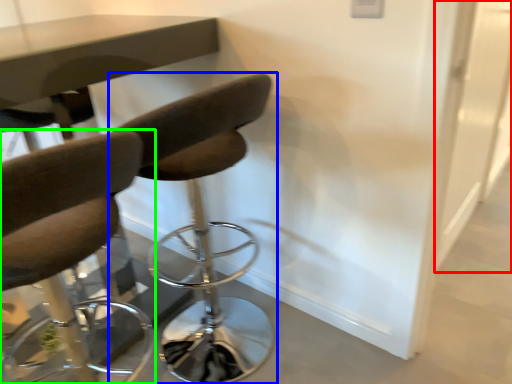
Question: Estimate the real-world distances between objects in this image. Which object is farther from glass door (highlighted by a red box), chair (highlighted by a blue box) or chair (highlighted by a green box)?

Choices:
 (A) chair
 (B) chair

Answer: (B)